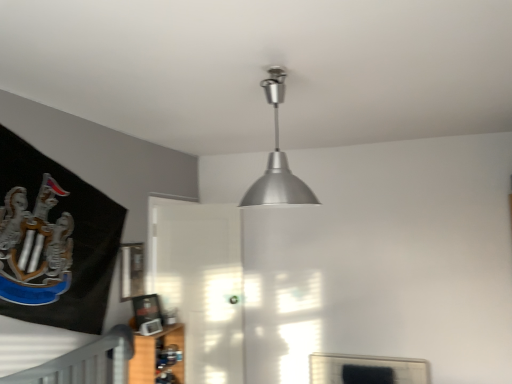
Question: From a real-world perspective, is silver metallic lampshade at upper center below wooden shelf at lower left?

Choices:
 (A) no
 (B) yes

Answer: (A)

Question: Is silver metallic lampshade at upper center thinner than wooden shelf at lower left?

Choices:
 (A) yes
 (B) no

Answer: (B)

Question: Is silver metallic lampshade at upper center oriented away from wooden shelf at lower left?

Choices:
 (A) no
 (B) yes

Answer: (A)

Question: Is silver metallic lampshade at upper center to the right of wooden shelf at lower left from the viewer's perspective?

Choices:
 (A) no
 (B) yes

Answer: (B)

Question: Does silver metallic lampshade at upper center turn towards wooden shelf at lower left?

Choices:
 (A) no
 (B) yes

Answer: (A)

Question: From a real-world perspective, is wooden shelf at lower left positioned above or below metallic silver picture frame at upper center?

Choices:
 (A) below
 (B) above

Answer: (A)

Question: Would you say wooden shelf at lower left is to the left or to the right of metallic silver picture frame at upper center in the picture?

Choices:
 (A) right
 (B) left

Answer: (A)

Question: In the image, is wooden shelf at lower left positioned in front of or behind metallic silver picture frame at upper center?

Choices:
 (A) behind
 (B) front

Answer: (B)

Question: From their relative heights in the image, would you say wooden shelf at lower left is taller or shorter than metallic silver picture frame at upper center?

Choices:
 (A) tall
 (B) short

Answer: (A)

Question: Visually, is metallic silver picture frame at upper center positioned to the left or to the right of wooden shelf at lower left?

Choices:
 (A) left
 (B) right

Answer: (A)

Question: Do you think metallic silver picture frame at upper center is within wooden shelf at lower left, or outside of it?

Choices:
 (A) inside
 (B) outside

Answer: (B)

Question: In the image, is metallic silver picture frame at upper center positioned in front of or behind wooden shelf at lower left?

Choices:
 (A) behind
 (B) front

Answer: (A)

Question: From their relative heights in the image, would you say metallic silver picture frame at upper center is taller or shorter than wooden shelf at lower left?

Choices:
 (A) short
 (B) tall

Answer: (A)

Question: Is silver metallic lampshade at upper center inside the boundaries of transparent glass door at center, or outside?

Choices:
 (A) outside
 (B) inside

Answer: (A)

Question: In the image, is silver metallic lampshade at upper center on the left side or the right side of transparent glass door at center?

Choices:
 (A) left
 (B) right

Answer: (B)